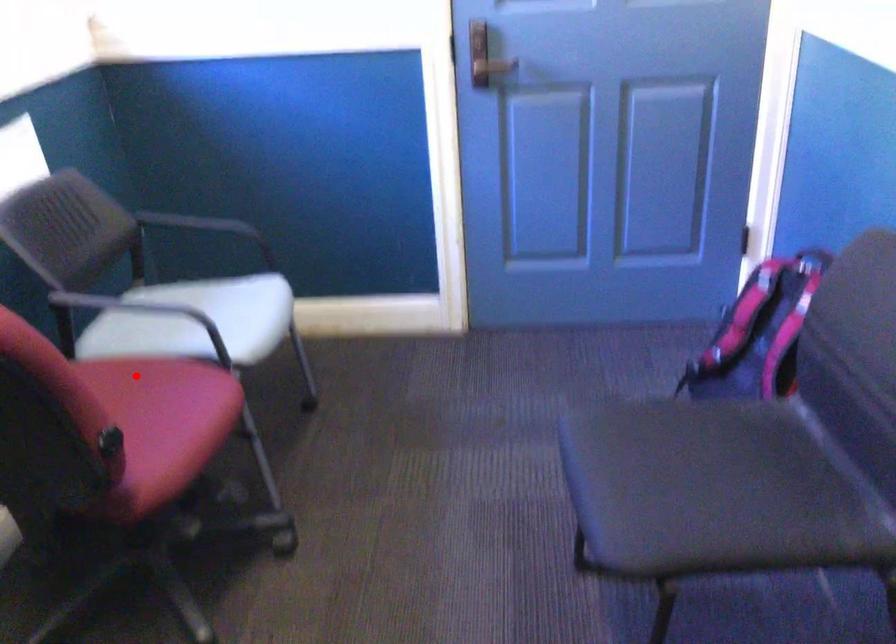
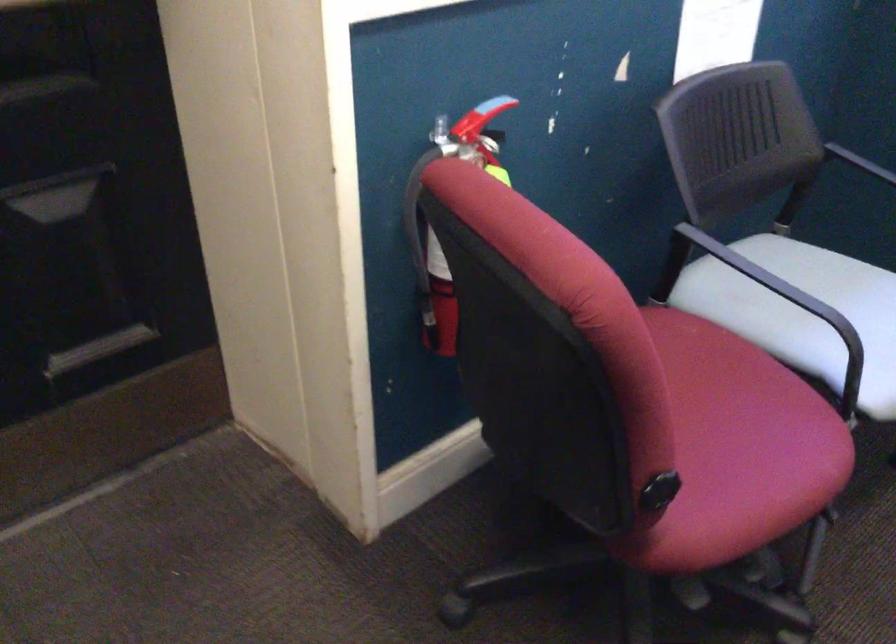
In the second image, find the point that corresponds to the highlighted location in the first image.

(714, 366)